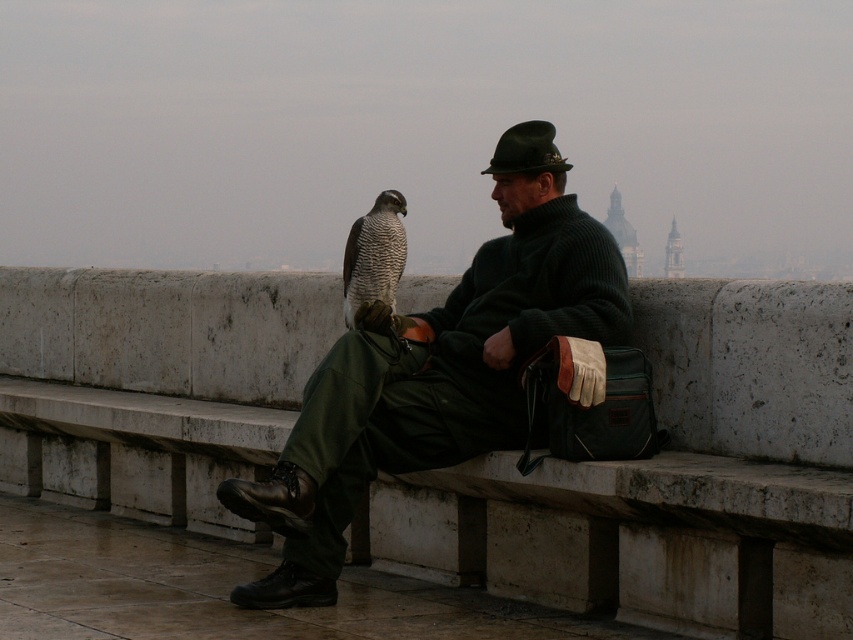
Question: Among these objects, which one is farthest from the camera?

Choices:
 (A) green felt hat at center
 (B) speckled feathers falcon at center

Answer: (B)

Question: Does matte green sweater at center have a smaller size compared to green felt hat at center?

Choices:
 (A) no
 (B) yes

Answer: (B)

Question: From the image, what is the correct spatial relationship of matte green sweater at center in relation to green felt hat at center?

Choices:
 (A) above
 (B) below

Answer: (B)

Question: Can you confirm if matte green sweater at center is positioned below green felt hat at center?

Choices:
 (A) yes
 (B) no

Answer: (A)

Question: Which point is farther from the camera taking this photo?

Choices:
 (A) (460, 394)
 (B) (354, 236)
 (C) (514, 136)

Answer: (B)

Question: Which object is closer to the camera taking this photo?

Choices:
 (A) green felt hat at center
 (B) matte green sweater at center
 (C) speckled feathers falcon at center

Answer: (B)